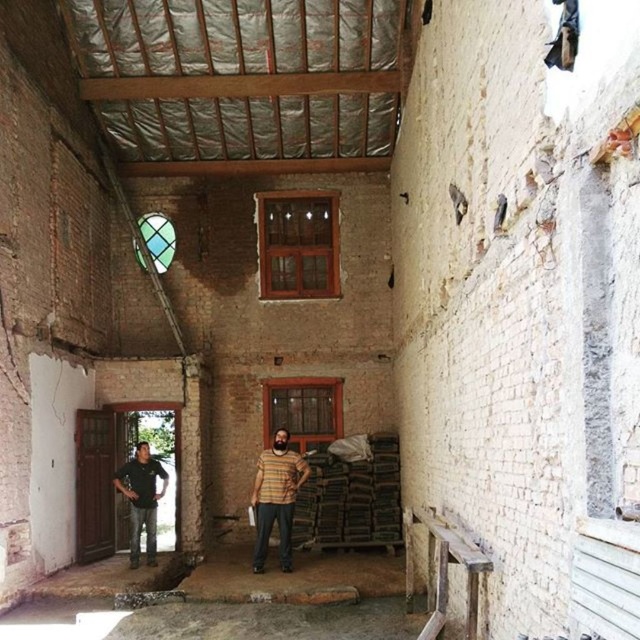
Does striped fabric shirt at center have a smaller size compared to black cotton shirt at left?

Correct, striped fabric shirt at center occupies less space than black cotton shirt at left.

Who is positioned more to the right, striped fabric shirt at center or black cotton shirt at left?

striped fabric shirt at center is more to the right.

Which is behind, point (289, 483) or point (154, 499)?

The point (154, 499) is behind.

Locate an element on the screen. striped fabric shirt at center is located at coordinates (275, 497).